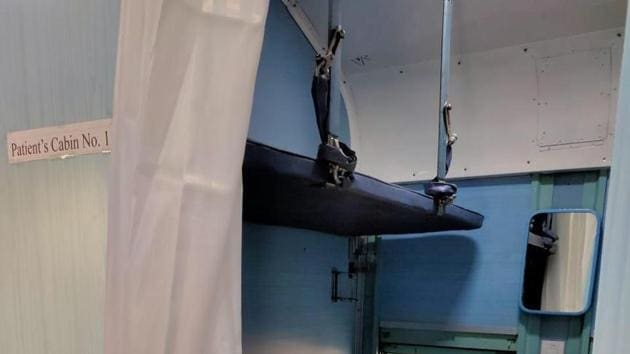
At what (x,y) coordinates should I click in order to perform the action: click on blue wall. Please return your answer as a coordinate pair (x, y). This screenshot has height=354, width=630. Looking at the image, I should click on (452, 282), (299, 282).